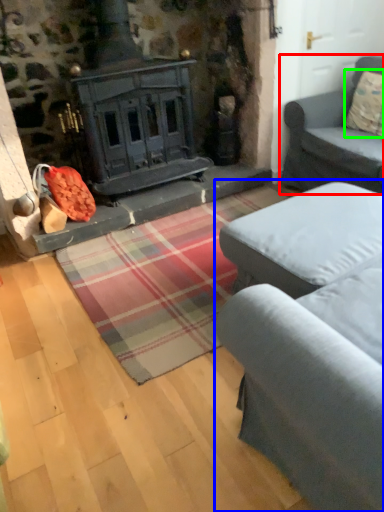
Question: Which object is the closest to the studio couch (highlighted by a red box)? Choose among these: studio couch (highlighted by a blue box) or pillow (highlighted by a green box).

Choices:
 (A) studio couch
 (B) pillow

Answer: (B)